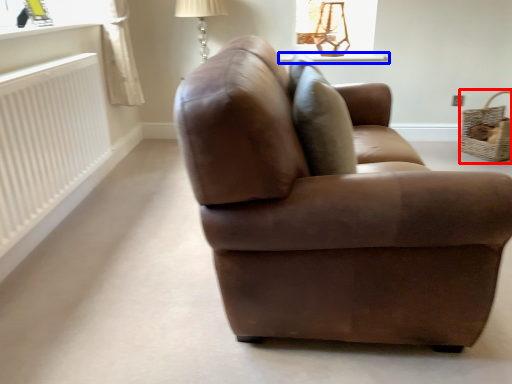
Question: Which of the following is the farthest to the observer, basket (highlighted by a red box) or window sill (highlighted by a blue box)?

Choices:
 (A) basket
 (B) window sill

Answer: (B)